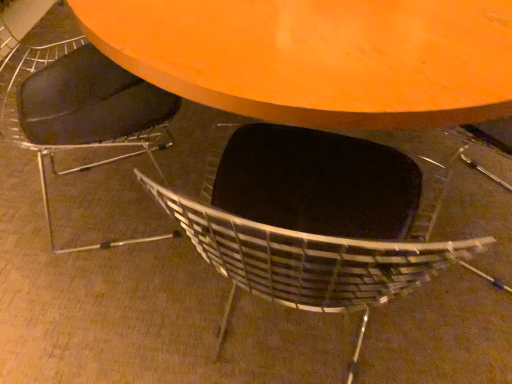
The height and width of the screenshot is (384, 512). Identify the location of vacant space in front of matte black chair at lower center, placed as the 1th chair when sorted from left to right. (104, 304).